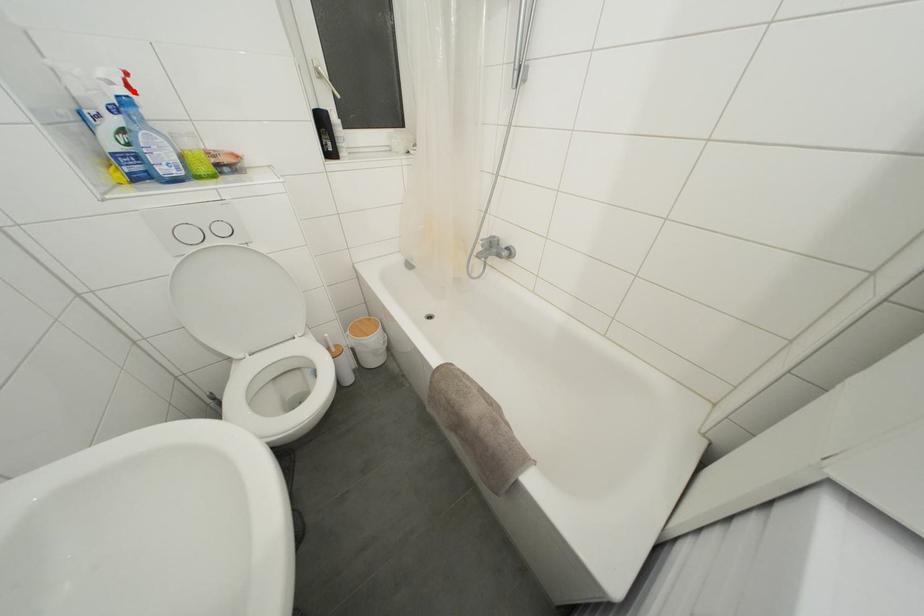
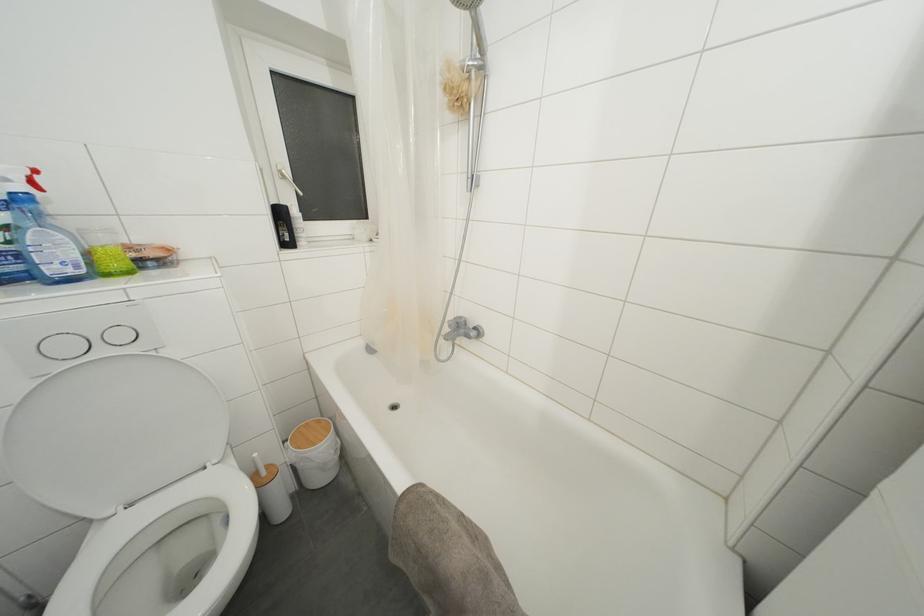
In the second image, find the point that corresponds to the highlighted location in the first image.

(37, 188)